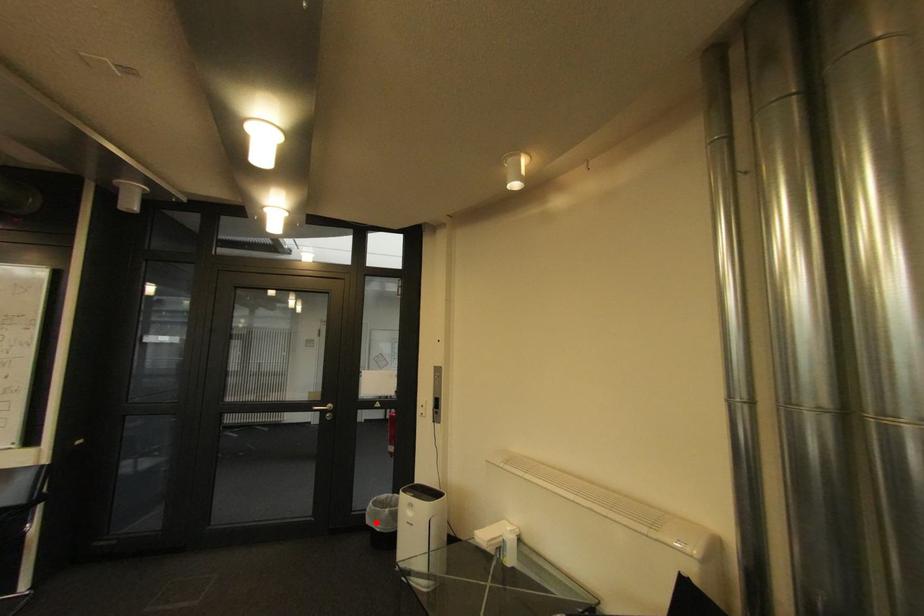
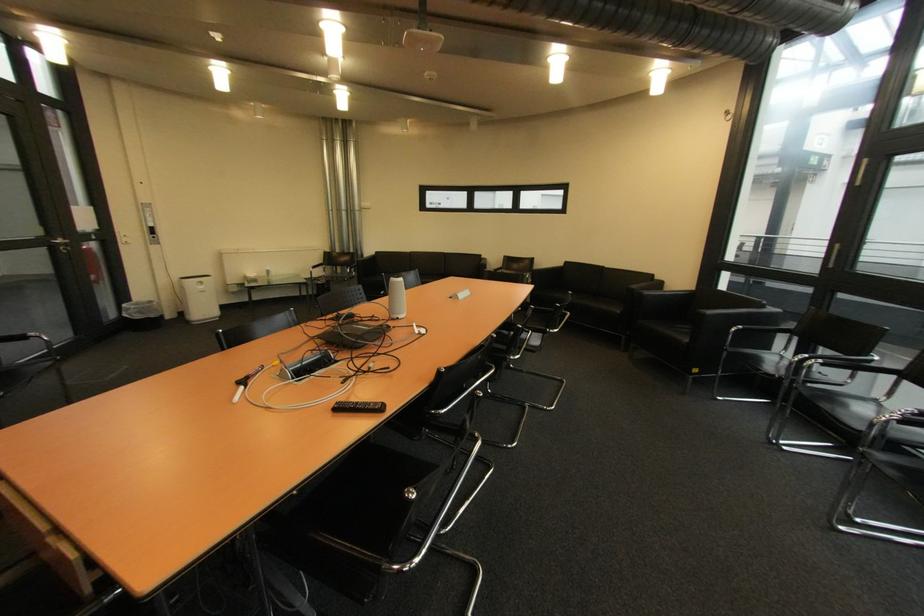
Where in the second image is the point corresponding to the highlighted location from the first image?

(147, 318)